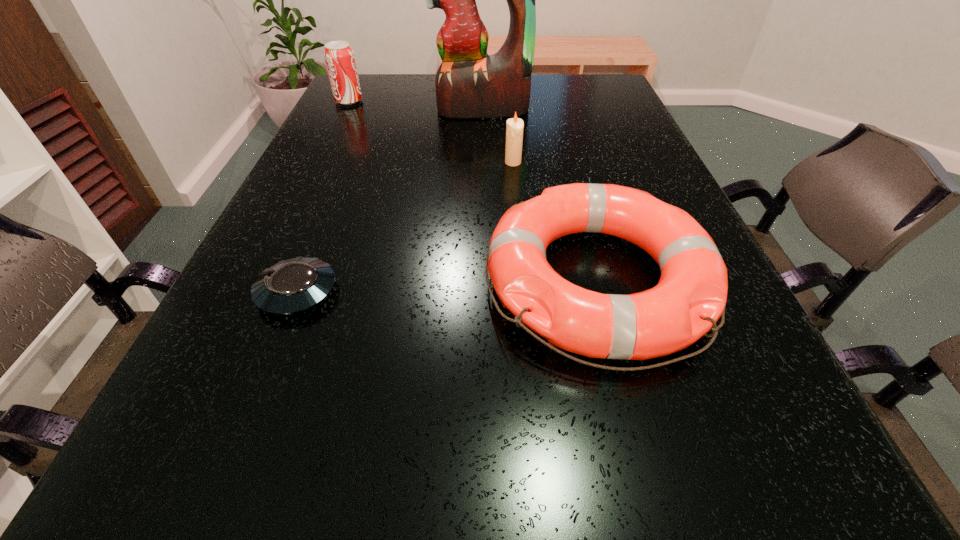
Where is `vacant space located on the back of the shortest object`? The height and width of the screenshot is (540, 960). vacant space located on the back of the shortest object is located at coordinates (348, 163).

This screenshot has height=540, width=960. In order to click on parrot situated at the far edge in this screenshot , I will do `click(469, 83)`.

Image resolution: width=960 pixels, height=540 pixels. I want to click on soda can at the far edge, so click(339, 57).

Locate an element on the screen. This screenshot has width=960, height=540. soda can located at the left edge is located at coordinates (339, 57).

I want to click on saucer that is at the left edge, so click(293, 285).

This screenshot has height=540, width=960. What are the coordinates of `object at the right edge` in the screenshot? It's located at (690, 297).

You are a GUI agent. You are given a task and a screenshot of the screen. Output one action in this format:
    pyautogui.click(x=<x>, y=<y>)
    Task: Click on the object that is at the far left corner
    The image size is (960, 540).
    Given the screenshot: What is the action you would take?
    pyautogui.click(x=339, y=57)

The width and height of the screenshot is (960, 540). Identify the location of vacant space at the far edge of the desktop. (436, 105).

Image resolution: width=960 pixels, height=540 pixels. In the image, there is a desktop. In order to click on vacant region at the near edge in this screenshot , I will do click(x=456, y=528).

Find the location of a particular element. Image resolution: width=960 pixels, height=540 pixels. free space at the left edge is located at coordinates (324, 134).